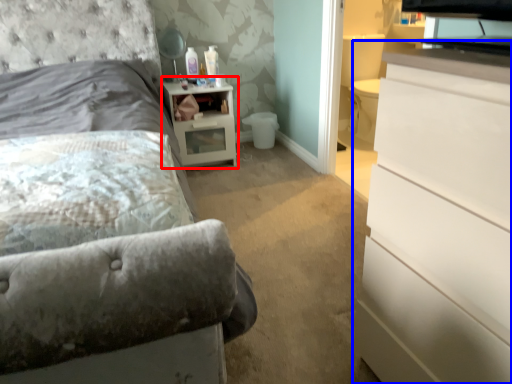
Question: Which of the following is the closest to the observer, nightstand (highlighted by a red box) or chest of drawers (highlighted by a blue box)?

Choices:
 (A) nightstand
 (B) chest of drawers

Answer: (B)